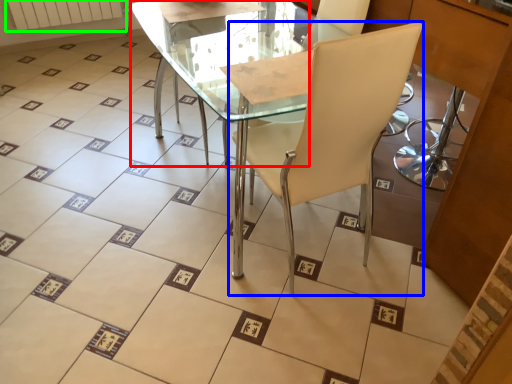
Question: Estimate the real-world distances between objects in this image. Which object is farther from round table (highlighted by a red box), chair (highlighted by a blue box) or radiator (highlighted by a green box)?

Choices:
 (A) chair
 (B) radiator

Answer: (B)